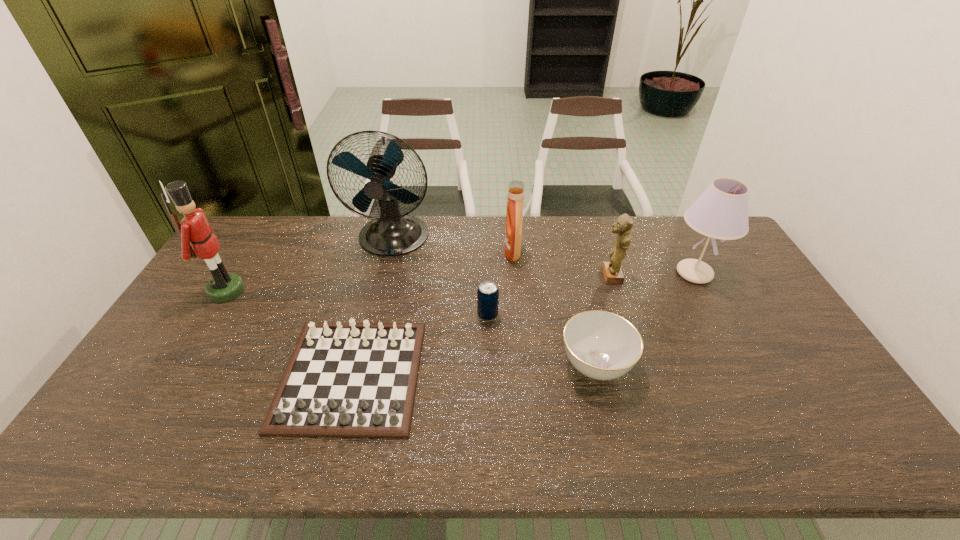
The width and height of the screenshot is (960, 540). I want to click on vacant space positioned on the front-facing side of the fan, so click(x=368, y=345).

Find the location of a particular element. This screenshot has height=540, width=960. vacant space positioned 0.090m on the front-facing side of the nutcracker is located at coordinates (272, 291).

Where is `free space located on the front of the third tallest object`? free space located on the front of the third tallest object is located at coordinates (724, 328).

This screenshot has width=960, height=540. What are the coordinates of `vacant space located on the front-facing side of the fifth object from left to right` in the screenshot? It's located at (439, 252).

Where is `vacant space located on the front-facing side of the fifth object from left to right`? vacant space located on the front-facing side of the fifth object from left to right is located at coordinates (462, 252).

The height and width of the screenshot is (540, 960). Find the location of `free spot located on the front-facing side of the fifth object from left to right`. free spot located on the front-facing side of the fifth object from left to right is located at coordinates (453, 252).

I want to click on vacant point located on the front-facing side of the figurine, so click(579, 276).

Find the location of a particular element. vacant region located 0.130m on the front-facing side of the figurine is located at coordinates (561, 276).

Locate an element on the screen. This screenshot has width=960, height=540. vacant area situated 0.090m on the front-facing side of the figurine is located at coordinates (573, 276).

Image resolution: width=960 pixels, height=540 pixels. Identify the location of vacant area located on the right of the fifth object from right to left. (518, 315).